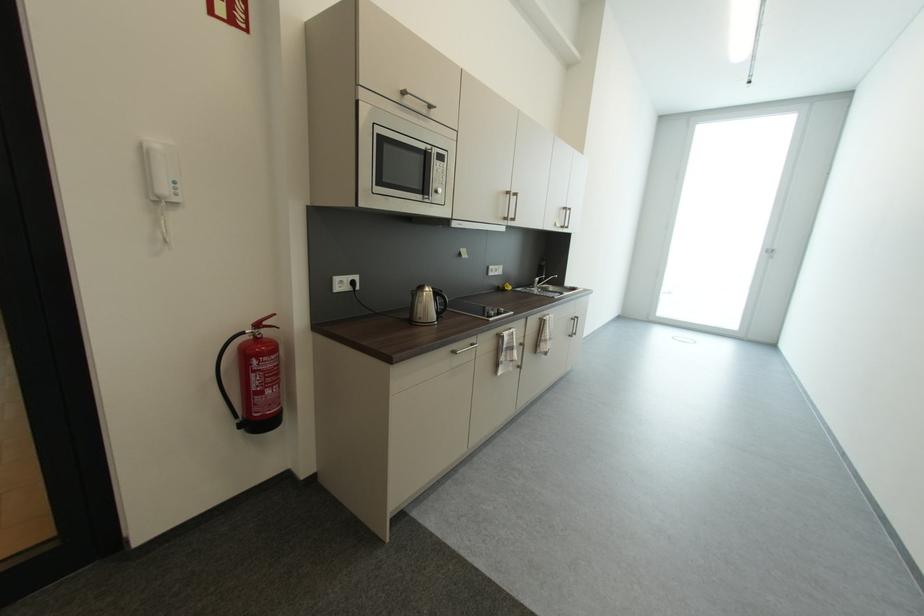
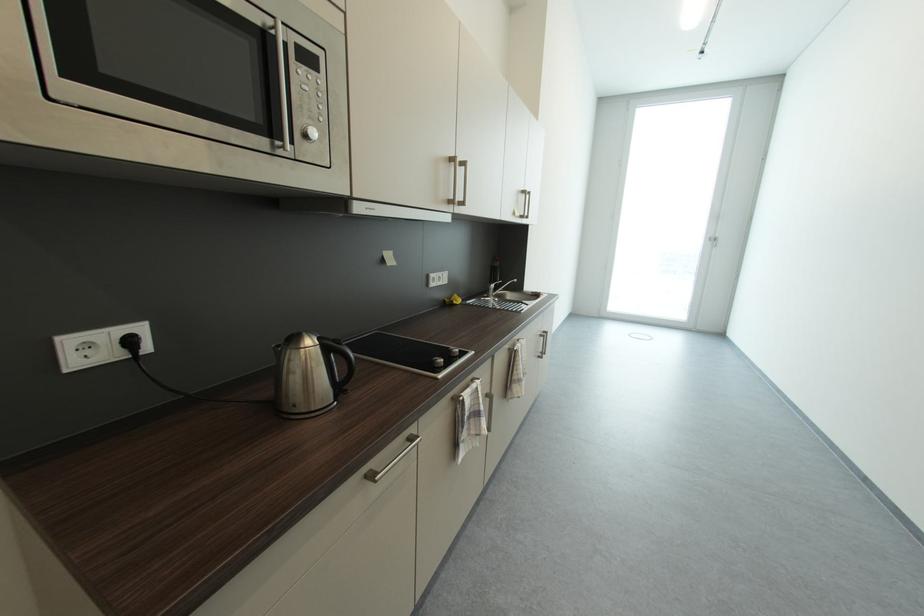
Locate, in the second image, the point that corresponds to (x=505, y=288) in the first image.

(453, 302)